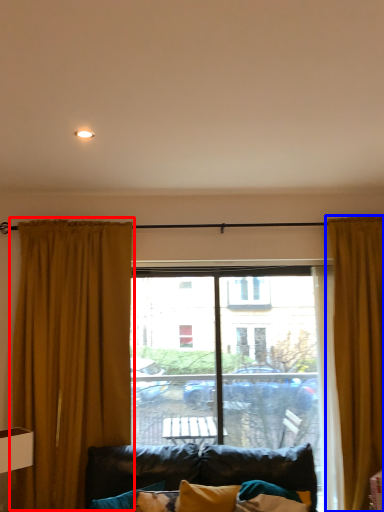
Question: Which object appears closest to the camera in this image, curtain (highlighted by a red box) or curtain (highlighted by a blue box)?

Choices:
 (A) curtain
 (B) curtain

Answer: (B)